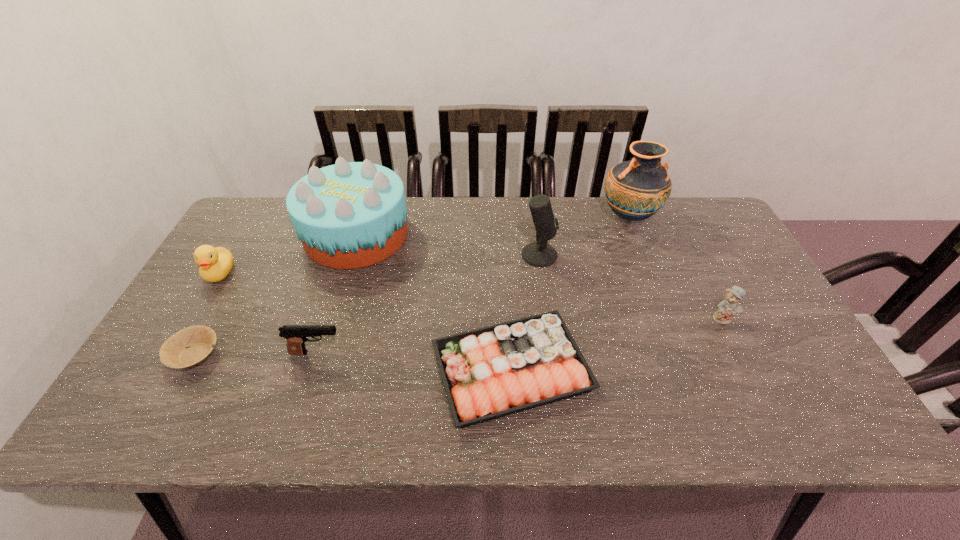
I want to click on free spot between the duckling and the pistol, so click(x=268, y=313).

I want to click on vacant area that lies between the bowl and the cake, so click(276, 295).

The width and height of the screenshot is (960, 540). In order to click on vacant space in between the microphone and the platter in this screenshot , I will do `click(525, 312)`.

You are a GUI agent. You are given a task and a screenshot of the screen. Output one action in this format:
    pyautogui.click(x=<x>, y=<y>)
    Task: Click on the vacant area between the teddy bear and the duckling
    
    Given the screenshot: What is the action you would take?
    pyautogui.click(x=471, y=295)

Where is `blank region between the platter and the seventh object from left to right`? blank region between the platter and the seventh object from left to right is located at coordinates (570, 293).

Find the location of a particular element. empty location between the platter and the pistol is located at coordinates (414, 361).

The width and height of the screenshot is (960, 540). Identify the location of empty space between the teddy bear and the cake. (540, 276).

You are a GUI agent. You are given a task and a screenshot of the screen. Output one action in this format:
    pyautogui.click(x=<x>, y=<y>)
    Task: Click on the object that stands as the fifth closest to the pottery
    This screenshot has height=540, width=960.
    Given the screenshot: What is the action you would take?
    pyautogui.click(x=296, y=335)

I want to click on object that can be found as the second closest to the shortest object, so click(x=296, y=335).

Find the location of `vacant position in the image that satisfies the following two spatial constraints: 1. on the face of the duckling; 2. on the left side of the platter`. vacant position in the image that satisfies the following two spatial constraints: 1. on the face of the duckling; 2. on the left side of the platter is located at coordinates (162, 369).